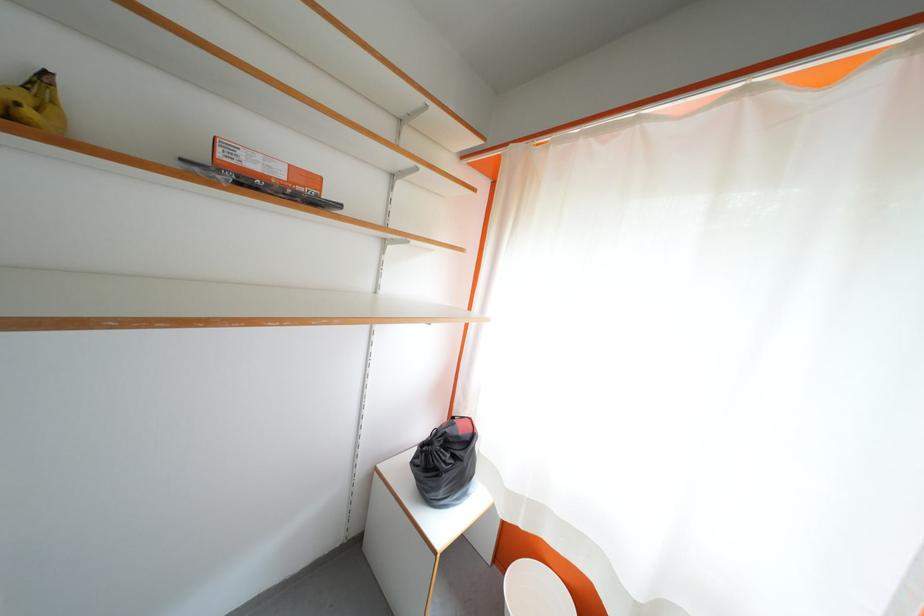
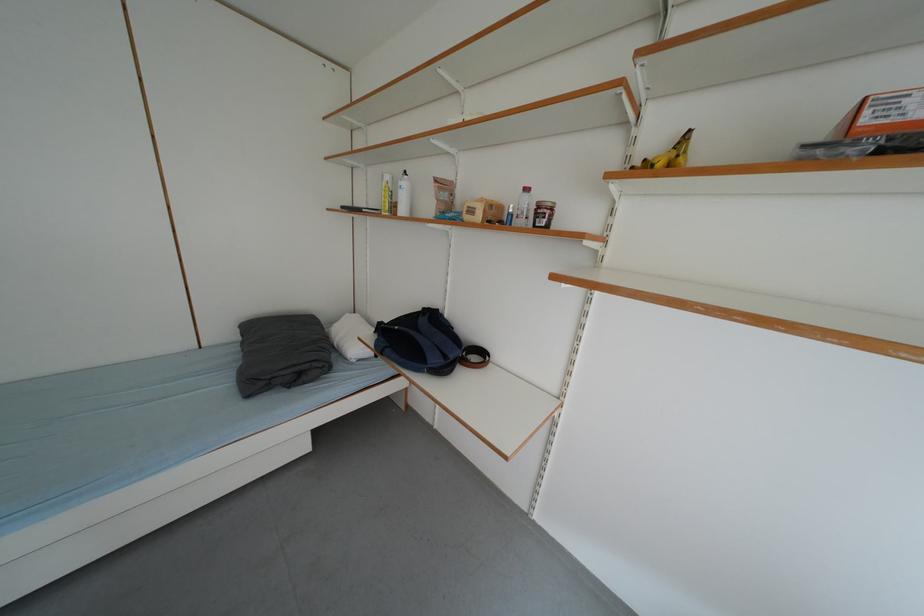
Question: The first image is from the beginning of the video and the second image is from the end. How did the camera likely rotate when shooting the video?

Choices:
 (A) Left
 (B) Right
 (C) Up
 (D) Down

Answer: (A)